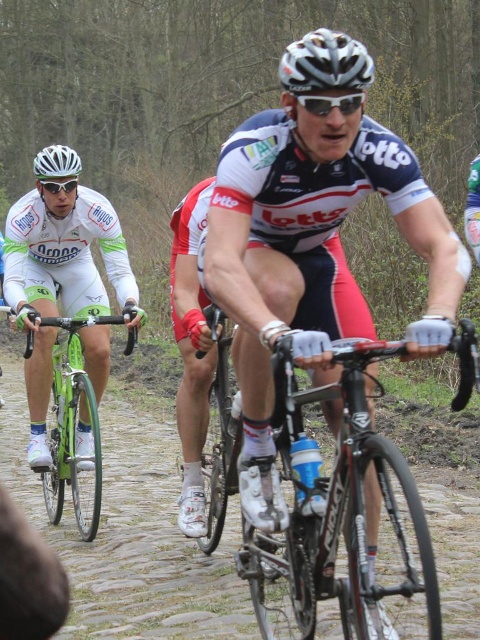
You are a photographer positioned at the side of the road during the cycling race. You want to capture a photo of both the shiny black frame at center and the shiny metallic bicycle at center in the same shot. Which object should you focus on first if you want to ensure both are in focus?

The shiny black frame at center has a lesser height compared to the shiny metallic bicycle at center. To ensure both are in focus, focus on the shiny metallic bicycle at center first since it is taller and requires more depth of field.

You are a photographer trying to capture the cyclist in the foreground. You notice the shiny black frame at center and the white matte bicycle helmet at upper left. Which object should you focus on to ensure the cyclist in the foreground is sharp in your photo?

The shiny black frame at center is closer to the viewer than the white matte bicycle helmet at upper left, so focusing on the shiny black frame at center will ensure the cyclist in the foreground is sharp.